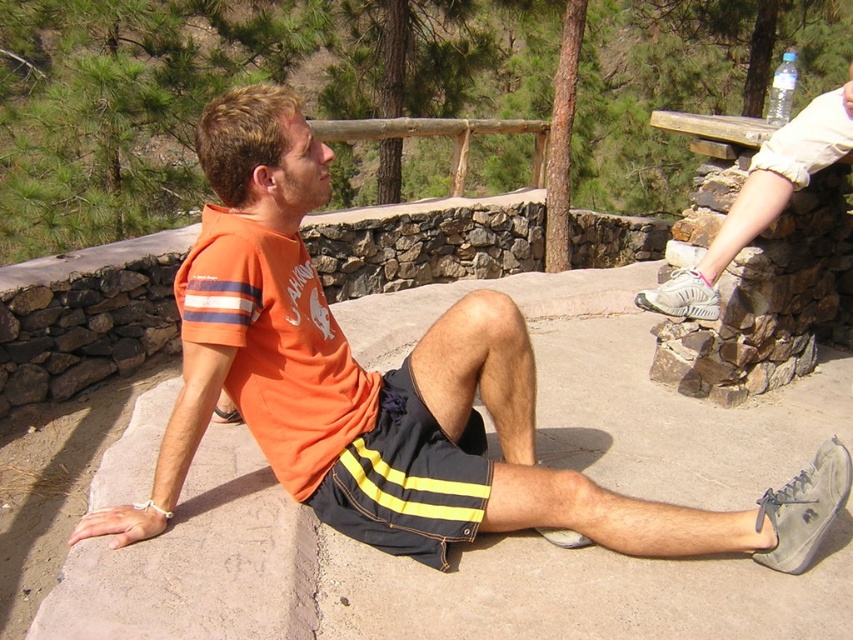
Question: Can you confirm if orange t-shirt at center is bigger than white matte shoe at upper right?

Choices:
 (A) yes
 (B) no

Answer: (A)

Question: Which of the following is the closest to the observer?

Choices:
 (A) (846, 80)
 (B) (424, 448)
 (C) (581, 500)

Answer: (C)

Question: Is orange t-shirt at center to the right of dark blue shorts with yellow stripes at center from the viewer's perspective?

Choices:
 (A) yes
 (B) no

Answer: (A)

Question: Which point is closer to the camera?

Choices:
 (A) (799, 545)
 (B) (438, 509)
 (C) (822, 93)

Answer: (B)

Question: Which of the following is the farthest from the observer?

Choices:
 (A) dark blue shorts with yellow stripes at center
 (B) orange t-shirt at center
 (C) white matte shoe at upper right

Answer: (C)

Question: Where is dark blue shorts with yellow stripes at center located in relation to white matte shoe at upper right in the image?

Choices:
 (A) right
 (B) left

Answer: (B)